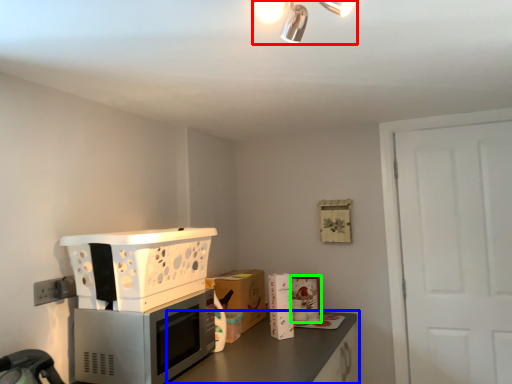
Question: Estimate the real-world distances between objects in this image. Which object is closer to light fixture (highlighted by a red box), countertop (highlighted by a blue box) or appliance (highlighted by a green box)?

Choices:
 (A) countertop
 (B) appliance

Answer: (A)